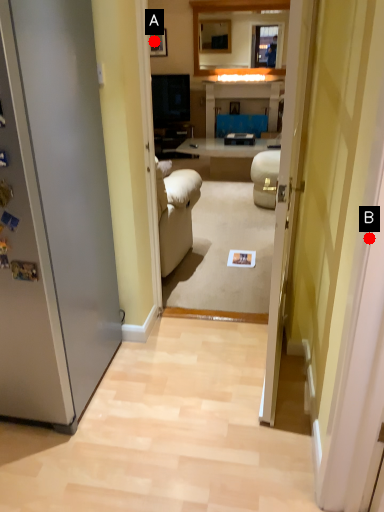
Question: Two points are circled on the image, labeled by A and B beside each circle. Which point is farther from the camera taking this photo?

Choices:
 (A) A is further
 (B) B is further

Answer: (A)